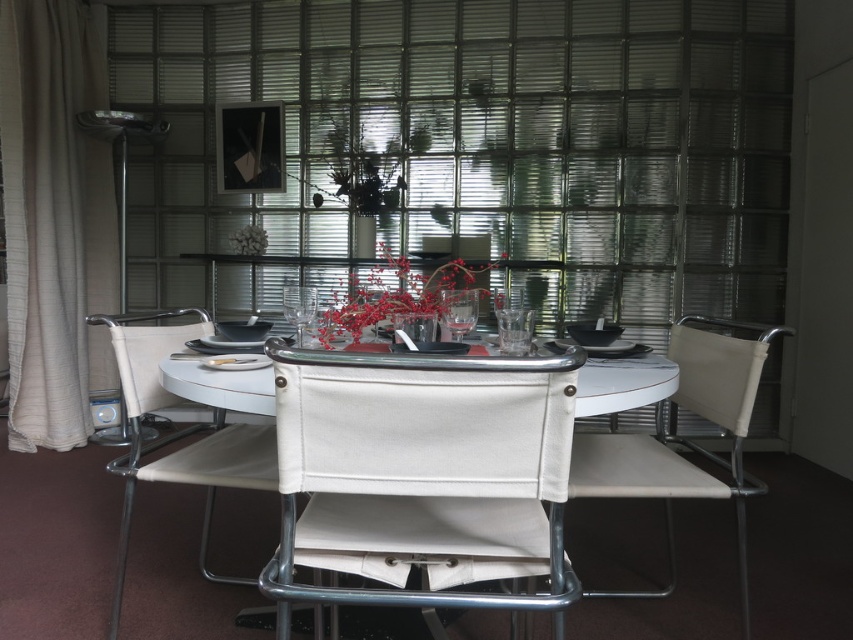
From the picture: Is white fabric chair at center smaller than red matte floral arrangement at center?

Correct, white fabric chair at center occupies less space than red matte floral arrangement at center.

Who is lower down, white fabric chair at center or red matte floral arrangement at center?

Positioned lower is white fabric chair at center.

This screenshot has height=640, width=853. I want to click on white fabric chair at center, so click(x=683, y=436).

Does point (738, 154) lie behind point (218, 369)?

Yes, it is.

Is point (424, 225) in front of point (258, 358)?

No, it is behind (258, 358).

What do you see at coordinates (489, 140) in the screenshot? I see `transparent glass blind at center` at bounding box center [489, 140].

The width and height of the screenshot is (853, 640). Identify the location of transparent glass blind at center. (489, 140).

Is point (471, 284) positioned in front of point (244, 237)?

Yes, it is.

Looking at this image, between red matte floral arrangement at center and white matte flower at center, which one has less height?

white matte flower at center is shorter.

Identify the location of red matte floral arrangement at center. (397, 291).